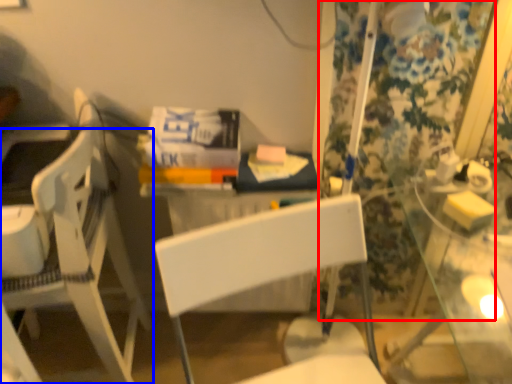
Question: Which of the following is the farthest to the observer, curtain (highlighted by a red box) or chair (highlighted by a blue box)?

Choices:
 (A) curtain
 (B) chair

Answer: (A)